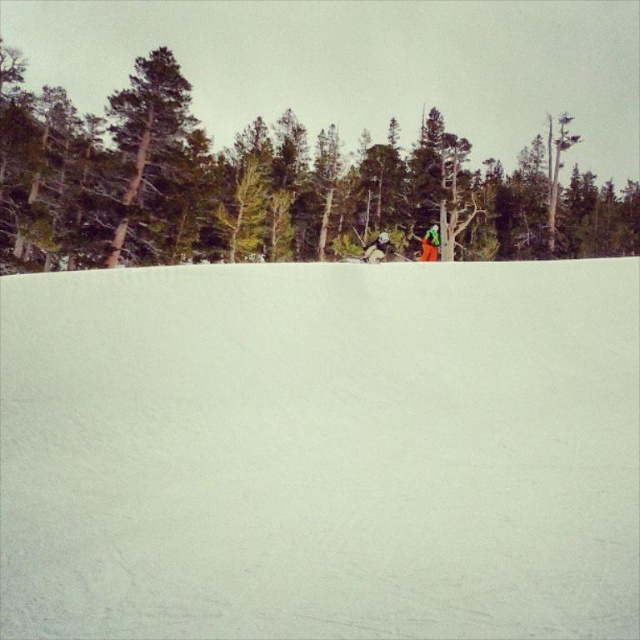
Is white snow at center bigger than green fabric jacket at center?

No, white snow at center is not bigger than green fabric jacket at center.

Between white snow at center and green fabric jacket at center, which one has less height?

With less height is white snow at center.

Between point (180, 515) and point (371, 259), which one is positioned in front?

Positioned in front is point (180, 515).

The height and width of the screenshot is (640, 640). In order to click on white snow at center in this screenshot , I will do `click(321, 451)`.

Between white snow at center and green matte tree at upper center, which one appears on the right side from the viewer's perspective?

From the viewer's perspective, green matte tree at upper center appears more on the right side.

Can you confirm if white snow at center is positioned below green matte tree at upper center?

Yes.

Find the location of a particular element. white snow at center is located at coordinates (321, 451).

Can you confirm if green matte tree at upper center is positioned below green fabric jacket at center?

No, green matte tree at upper center is not below green fabric jacket at center.

Who is positioned more to the right, green matte tree at upper center or green fabric jacket at center?

green matte tree at upper center

I want to click on green matte tree at upper center, so click(x=262, y=186).